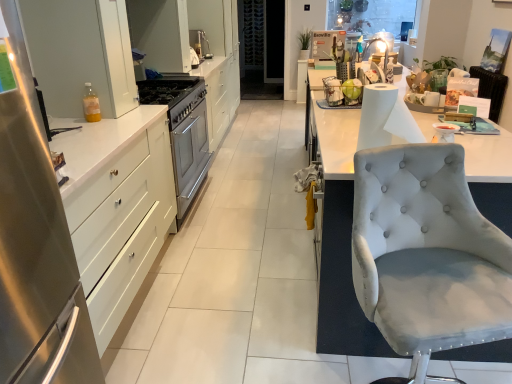
Image resolution: width=512 pixels, height=384 pixels. Find the location of `translucent plastic bottle at left`. translucent plastic bottle at left is located at coordinates (91, 105).

What is the approximate height of translucent plastic bottle at left?

7.80 inches.

Locate an element on the screen. Image resolution: width=512 pixels, height=384 pixels. satin silver gas stove at center is located at coordinates click(173, 96).

The height and width of the screenshot is (384, 512). What do you see at coordinates (173, 96) in the screenshot?
I see `satin silver gas stove at center` at bounding box center [173, 96].

Identify the location of light gray fabric chair at right. (426, 254).

This screenshot has width=512, height=384. What are the coordinates of `translucent plastic bottle at left` in the screenshot? It's located at (91, 105).

From the image's perspective, which one is positioned higher, white glossy cabinet at upper left, which is the second cabinetry from front to back, or white paper at right?

white glossy cabinet at upper left, which is the second cabinetry from front to back, is shown above in the image.

In the image, is white glossy cabinet at upper left, which is the second cabinetry from front to back, positioned in front of or behind white paper at right?

Visually, white glossy cabinet at upper left, which is the second cabinetry from front to back, is located behind white paper at right.

At what (x,y) coordinates should I click in order to perform the action: click on the 1st cabinetry behind the white paper at right, counting from the anchor's position. Please return your answer as a coordinate pair (x, y). Looking at the image, I should click on (81, 54).

Looking at this image, measure the distance between white glossy cabinet at upper left, which is the second cabinetry from front to back, and white paper at right.

white glossy cabinet at upper left, which is the second cabinetry from front to back, and white paper at right are 4.85 feet apart.

Is point (494, 286) in front of point (85, 115)?

Yes, it is.

Which of these two, light gray fabric chair at right or translucent plastic bottle at left, is bigger?

light gray fabric chair at right is bigger.

Which object is thinner, light gray fabric chair at right or translucent plastic bottle at left?

translucent plastic bottle at left is thinner.

From a real-world perspective, is light gray fabric chair at right on translucent plastic bottle at left?

No.

Is white paper at right next to white glossy cabinet at upper left, the 2th cabinetry in the top-to-bottom sequence?

white paper at right and white glossy cabinet at upper left, the 2th cabinetry in the top-to-bottom sequence, are not in contact.

How far apart are white paper at right and white glossy cabinet at upper left, the second cabinetry in the back-to-front sequence?

white paper at right is 4.85 feet away from white glossy cabinet at upper left, the second cabinetry in the back-to-front sequence.

From the image's perspective, is white paper at right above white glossy cabinet at upper left, the second cabinetry in the bottom-to-top sequence?

No.

Is white paper at right to the left or to the right of satin silver sink at center in the image?

From the image, it's evident that white paper at right is to the right of satin silver sink at center.

Is point (402, 115) in front of point (173, 148)?

That is True.

From the image's perspective, which one is positioned higher, white paper at right or satin silver sink at center?

white paper at right is shown above in the image.

In terms of size, does white paper at right appear bigger or smaller than satin silver sink at center?

Considering their sizes, white paper at right takes up less space than satin silver sink at center.

Is white glossy cabinet at upper left, the second cabinetry in the back-to-front sequence, oriented away from translucent plastic bottle at left?

No, white glossy cabinet at upper left, the second cabinetry in the back-to-front sequence, is not facing the opposite direction of translucent plastic bottle at left.

From a real-world perspective, is white glossy cabinet at upper left, which is the second cabinetry from front to back, physically located above or below translucent plastic bottle at left?

In terms of real-world spatial position, white glossy cabinet at upper left, which is the second cabinetry from front to back, is above translucent plastic bottle at left.

From the image's perspective, which is below, white glossy cabinet at upper left, which is the second cabinetry from front to back, or translucent plastic bottle at left?

translucent plastic bottle at left, from the image's perspective.

Could you tell me if satin white drawers at left, which is the third cabinetry in back-to-front order, is facing translucent plastic bottle at left?

No.

Between satin white drawers at left, the third cabinetry from the top, and translucent plastic bottle at left, which one has smaller size?

With smaller size is translucent plastic bottle at left.

Would you say satin white drawers at left, acting as the first cabinetry starting from the front, is inside or outside translucent plastic bottle at left?

The correct answer is: outside.

How many degrees apart are the facing directions of white glossy cabinet at upper left, the 1th cabinetry in the back-to-front sequence, and translucent plastic bottle at left?

0.139 degrees separate the facing orientations of white glossy cabinet at upper left, the 1th cabinetry in the back-to-front sequence, and translucent plastic bottle at left.

From a real-world perspective, is white glossy cabinet at upper left, which is the 3th cabinetry from bottom to top, located beneath translucent plastic bottle at left?

No, from a real-world perspective, white glossy cabinet at upper left, which is the 3th cabinetry from bottom to top, is not below translucent plastic bottle at left.

Consider the image. Who is shorter, white glossy cabinet at upper left, the 1th cabinetry in the back-to-front sequence, or translucent plastic bottle at left?

Standing shorter between the two is translucent plastic bottle at left.

From the image's perspective, is white glossy cabinet at upper left, the 1th cabinetry from the top, located above or below translucent plastic bottle at left?

Based on their image positions, white glossy cabinet at upper left, the 1th cabinetry from the top, is located above translucent plastic bottle at left.

Locate an element on the screen. the 1st cabinetry behind the white paper at right is located at coordinates (81, 54).

Find the location of a particular element. The width and height of the screenshot is (512, 384). bottle located on the left of light gray fabric chair at right is located at coordinates (91, 105).

Considering their positions, is white glossy cabinet at upper left, the second cabinetry in the bottom-to-top sequence, positioned further to satin silver gas stove at center than white glossy cabinet at upper left, which is the 3th cabinetry from bottom to top?

white glossy cabinet at upper left, which is the 3th cabinetry from bottom to top.

Considering their positions, is white glossy cabinet at upper left, which is the second cabinetry from front to back, positioned further to translucent plastic bottle at left than satin white drawers at left, which is the third cabinetry in back-to-front order?

satin white drawers at left, which is the third cabinetry in back-to-front order, lies further to translucent plastic bottle at left than the other object.

When comparing their distances from satin silver gas stove at center, does satin silver sink at center or white glossy cabinet at upper left, the 1th cabinetry from the top, seem further?

The object further to satin silver gas stove at center is white glossy cabinet at upper left, the 1th cabinetry from the top.

Considering their positions, is white glossy cabinet at upper left, which is the 3th cabinetry from bottom to top, positioned closer to white glossy cabinet at upper left, the second cabinetry in the back-to-front sequence, than light gray fabric chair at right?

The object closer to white glossy cabinet at upper left, the second cabinetry in the back-to-front sequence, is white glossy cabinet at upper left, which is the 3th cabinetry from bottom to top.

Considering their positions, is satin white drawers at left, which is the third cabinetry in back-to-front order, positioned closer to white paper at right than satin silver gas stove at center?

Among the two, satin white drawers at left, which is the third cabinetry in back-to-front order, is located nearer to white paper at right.

Looking at the image, which one is located closer to white glossy cabinet at upper left, the second cabinetry in the back-to-front sequence, white paper at right or light gray fabric chair at right?

Based on the image, white paper at right appears to be nearer to white glossy cabinet at upper left, the second cabinetry in the back-to-front sequence.

Estimate the real-world distances between objects in this image. Which object is closer to satin silver gas stove at center, white glossy cabinet at upper left, the second cabinetry in the back-to-front sequence, or satin silver sink at center?

satin silver sink at center is positioned closer to the anchor satin silver gas stove at center.

From the image, which object appears to be nearer to satin silver sink at center, white glossy cabinet at upper left, the 3th cabinetry when ordered from front to back, or translucent plastic bottle at left?

Among the two, white glossy cabinet at upper left, the 3th cabinetry when ordered from front to back, is located nearer to satin silver sink at center.

Locate an element on the screen. sink between white paper at right and white glossy cabinet at upper left, the 1th cabinetry in the back-to-front sequence, along the z-axis is located at coordinates (183, 132).

Locate an element on the screen. The image size is (512, 384). cabinetry between satin white drawers at left, which is the third cabinetry in back-to-front order, and satin silver gas stove at center, along the z-axis is located at coordinates (81, 54).

Where is `paper towel between satin white drawers at left, which is the third cabinetry in back-to-front order, and light gray fabric chair at right`? The height and width of the screenshot is (384, 512). paper towel between satin white drawers at left, which is the third cabinetry in back-to-front order, and light gray fabric chair at right is located at coordinates (386, 119).

Image resolution: width=512 pixels, height=384 pixels. I want to click on sink between satin white drawers at left, the third cabinetry from the top, and white glossy cabinet at upper left, the 1th cabinetry in the back-to-front sequence, along the z-axis, so click(x=183, y=132).